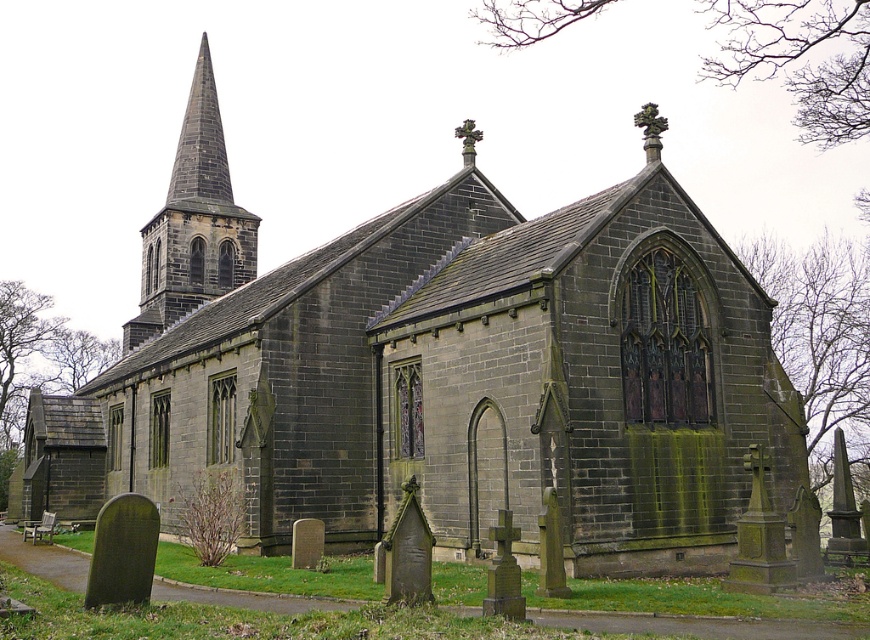
Question: Can you confirm if dark gray stone steeple at upper left is wider than carved stone cross at upper center?

Choices:
 (A) yes
 (B) no

Answer: (A)

Question: Which point appears farthest from the camera in this image?

Choices:
 (A) (470, 132)
 (B) (224, 280)

Answer: (B)

Question: Which object is farther from the camera taking this photo?

Choices:
 (A) carved stone cross at upper center
 (B) dark gray stone steeple at upper left

Answer: (B)

Question: Does dark gray stone steeple at upper left have a smaller size compared to carved stone cross at upper center?

Choices:
 (A) no
 (B) yes

Answer: (A)

Question: Which of the following is the farthest from the observer?

Choices:
 (A) carved stone cross at upper center
 (B) dark gray stone steeple at upper left

Answer: (B)

Question: Does dark gray stone steeple at upper left lie behind carved stone cross at upper center?

Choices:
 (A) no
 (B) yes

Answer: (B)